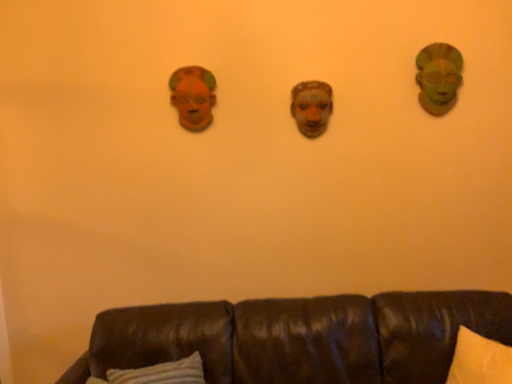
Question: Is green matte mask at upper right at the right side of matte clay mask at center?

Choices:
 (A) yes
 (B) no

Answer: (A)

Question: Is the position of green matte mask at upper right less distant than that of matte clay mask at center?

Choices:
 (A) yes
 (B) no

Answer: (A)

Question: Are green matte mask at upper right and matte clay mask at center far apart?

Choices:
 (A) no
 (B) yes

Answer: (A)

Question: From the image's perspective, does green matte mask at upper right appear lower than matte clay mask at center?

Choices:
 (A) yes
 (B) no

Answer: (B)

Question: Can you confirm if green matte mask at upper right is wider than matte clay mask at center?

Choices:
 (A) yes
 (B) no

Answer: (A)

Question: Is green matte mask at upper right situated inside matte orange mask at upper left or outside?

Choices:
 (A) inside
 (B) outside

Answer: (B)

Question: Does point (422, 57) appear closer or farther from the camera than point (195, 66)?

Choices:
 (A) closer
 (B) farther

Answer: (A)

Question: Based on their positions, is green matte mask at upper right located to the left or right of matte orange mask at upper left?

Choices:
 (A) right
 (B) left

Answer: (A)

Question: Considering their positions, is green matte mask at upper right located in front of or behind matte orange mask at upper left?

Choices:
 (A) front
 (B) behind

Answer: (A)

Question: Is matte clay mask at center in front of or behind green matte mask at upper right in the image?

Choices:
 (A) front
 (B) behind

Answer: (B)

Question: Is matte clay mask at center wider or thinner than green matte mask at upper right?

Choices:
 (A) wide
 (B) thin

Answer: (B)

Question: From a real-world perspective, is matte clay mask at center physically located above or below green matte mask at upper right?

Choices:
 (A) above
 (B) below

Answer: (B)

Question: Is matte clay mask at center bigger or smaller than green matte mask at upper right?

Choices:
 (A) small
 (B) big

Answer: (A)

Question: From a real-world perspective, relative to matte clay mask at center, is matte orange mask at upper left vertically above or below?

Choices:
 (A) above
 (B) below

Answer: (A)

Question: Do you think matte orange mask at upper left is within matte clay mask at center, or outside of it?

Choices:
 (A) outside
 (B) inside

Answer: (A)